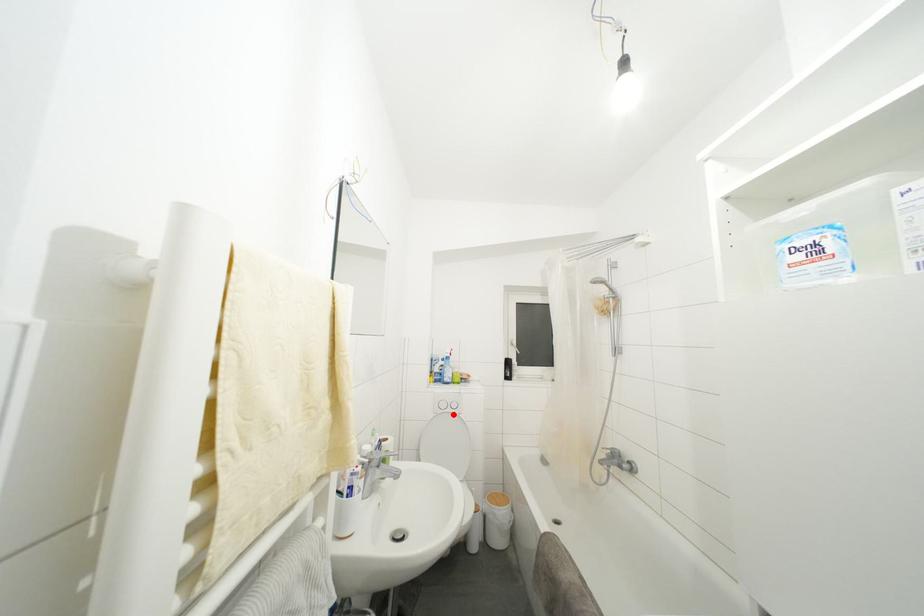
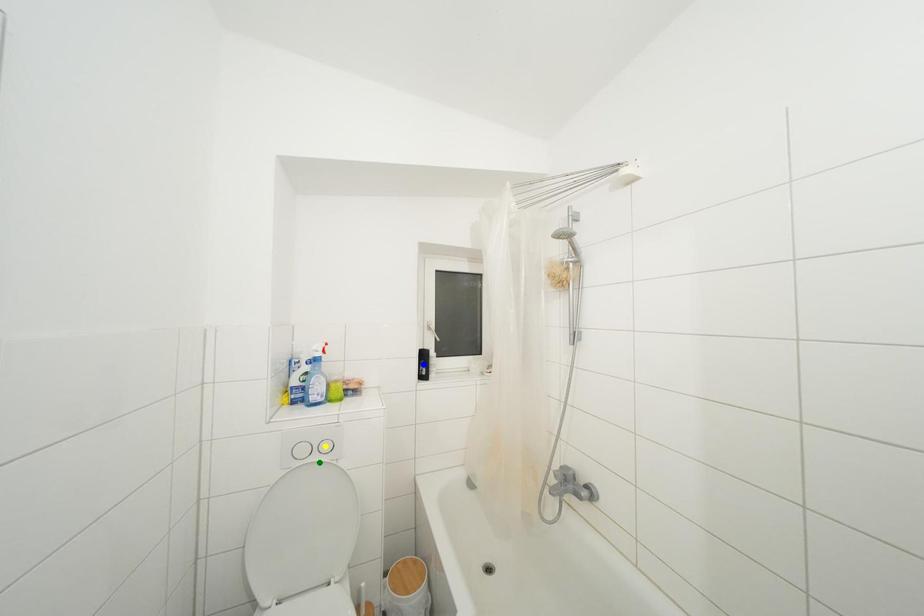
Question: I am providing you with two images of the same scene from different viewpoints. A red point is marked on the first image. You are given multiple points on the second image. Which mark in image 2 goes with the point in image 1?

Choices:
 (A) yellow point
 (B) blue point
 (C) green point

Answer: (C)